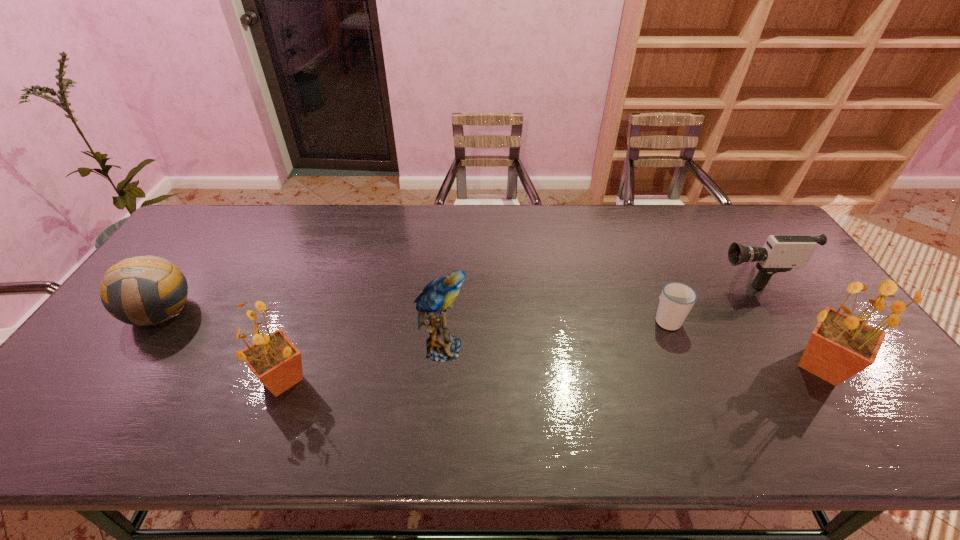
At what (x,y) coordinates should I click in order to perform the action: click on the left sunflower. Please return your answer as a coordinate pair (x, y). Looking at the image, I should click on (276, 362).

You are a GUI agent. You are given a task and a screenshot of the screen. Output one action in this format:
    pyautogui.click(x=<x>, y=<y>)
    Task: Click on the fifth object from right to left
    The height and width of the screenshot is (540, 960).
    Given the screenshot: What is the action you would take?
    pyautogui.click(x=276, y=362)

Identify the location of the taller sunflower. (840, 346).

Locate an element on the screen. Image resolution: width=960 pixels, height=540 pixels. cup is located at coordinates (676, 299).

You are a GUI agent. You are given a task and a screenshot of the screen. Output one action in this format:
    pyautogui.click(x=<x>, y=<y>)
    Task: Click on the shortest object
    
    Given the screenshot: What is the action you would take?
    pyautogui.click(x=676, y=299)

Where is `the third object from left to right`? The width and height of the screenshot is (960, 540). the third object from left to right is located at coordinates (436, 299).

The width and height of the screenshot is (960, 540). What are the coordinates of `the leftmost object` in the screenshot? It's located at (144, 290).

Locate an element on the screen. camcorder is located at coordinates (780, 253).

The width and height of the screenshot is (960, 540). Find the location of `blank space located at the front of the shorter sunflower with flowers visible`. blank space located at the front of the shorter sunflower with flowers visible is located at coordinates (196, 379).

Where is `vacant space situated 0.050m at the front of the shorter sunflower with flowers visible`? vacant space situated 0.050m at the front of the shorter sunflower with flowers visible is located at coordinates tap(232, 379).